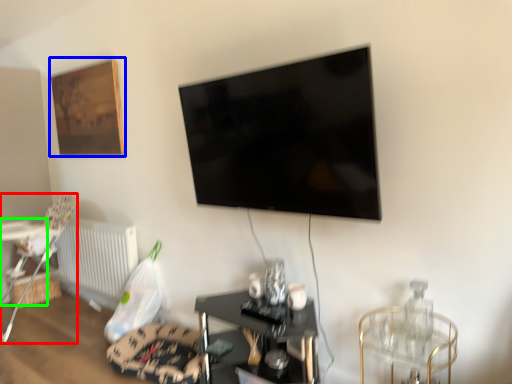
Question: Considering the real-world distances, which object is farthest from chair (highlighted by a red box)? picture frame (highlighted by a blue box) or table (highlighted by a green box)?

Choices:
 (A) picture frame
 (B) table

Answer: (A)